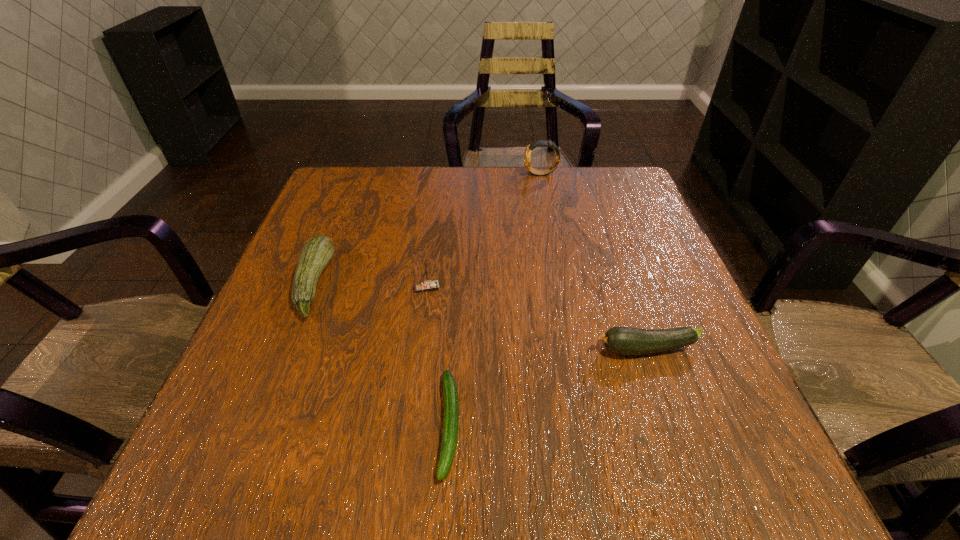
Image resolution: width=960 pixels, height=540 pixels. Find the location of `free region located on the face of the watch`. free region located on the face of the watch is located at coordinates (465, 174).

Where is `vacant space located on the front of the fourth object from right to left`? The width and height of the screenshot is (960, 540). vacant space located on the front of the fourth object from right to left is located at coordinates (405, 460).

Identify the location of free region located at the stem end of the third tallest object. (391, 284).

At what (x,y) coordinates should I click in order to perform the action: click on blank space located at the blossom end of the second shortest zucchini. Please return your answer as a coordinate pair (x, y). This screenshot has height=540, width=960. Looking at the image, I should click on (418, 349).

Locate an element on the screen. free space located at the blossom end of the second shortest zucchini is located at coordinates (521, 349).

This screenshot has height=540, width=960. I want to click on free point located 0.180m at the blossom end of the second shortest zucchini, so click(x=494, y=349).

Locate an element on the screen. object present at the far edge is located at coordinates (527, 155).

Find the location of a particular element. The image size is (960, 540). object that is at the near edge is located at coordinates (451, 401).

You are a GUI agent. You are given a task and a screenshot of the screen. Output one action in this format:
    pyautogui.click(x=<x>, y=<y>)
    Task: Click on the object situated at the left edge
    Image resolution: width=960 pixels, height=540 pixels.
    Given the screenshot: What is the action you would take?
    pyautogui.click(x=318, y=251)

Where is `object positioned at the right edge`? object positioned at the right edge is located at coordinates (619, 340).